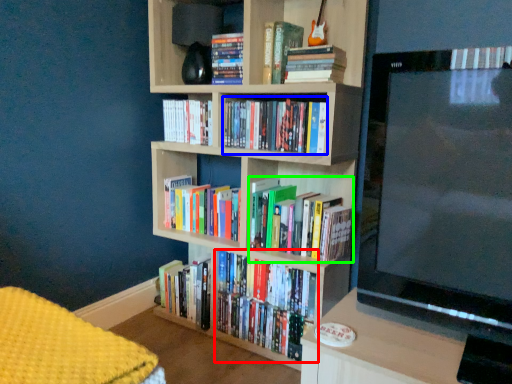
Question: Which object is positioned farthest from book (highlighted by a red box)? Select from book (highlighted by a blue box) and book (highlighted by a green box).

Choices:
 (A) book
 (B) book

Answer: (A)